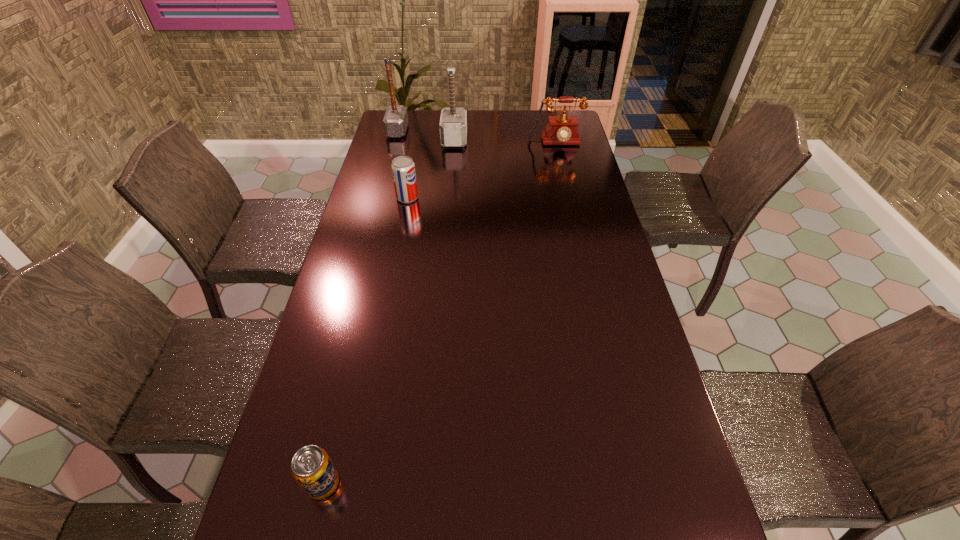
Locate an element on the screen. The image size is (960, 540). the left hammer is located at coordinates (395, 121).

You are a GUI agent. You are given a task and a screenshot of the screen. Output one action in this format:
    pyautogui.click(x=<x>, y=<y>)
    Task: Click on the right hammer
    This screenshot has width=960, height=540.
    Given the screenshot: What is the action you would take?
    pyautogui.click(x=453, y=122)

Identify the location of the third tallest object. (561, 130).

Find the location of a particular element. The width and height of the screenshot is (960, 540). telephone is located at coordinates (561, 130).

The width and height of the screenshot is (960, 540). I want to click on the second nearest object, so click(x=403, y=168).

Where is `the second shortest object`? This screenshot has height=540, width=960. the second shortest object is located at coordinates (403, 168).

Where is `the shortest object`? the shortest object is located at coordinates (311, 467).

I want to click on the nearer soda can, so click(311, 467).

Image resolution: width=960 pixels, height=540 pixels. In order to click on free point located on the striking surface of the left hammer in this screenshot , I will do `click(492, 131)`.

At what (x,y) coordinates should I click in order to perform the action: click on free spot located for striking with the head of the right hammer. Please return your answer as a coordinate pair (x, y). The height and width of the screenshot is (540, 960). Looking at the image, I should click on (488, 139).